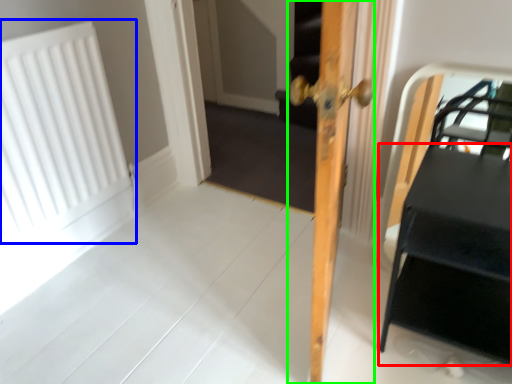
Question: Which is farther away from table (highlighted by a red box)? radiator (highlighted by a blue box) or door (highlighted by a green box)?

Choices:
 (A) radiator
 (B) door

Answer: (A)